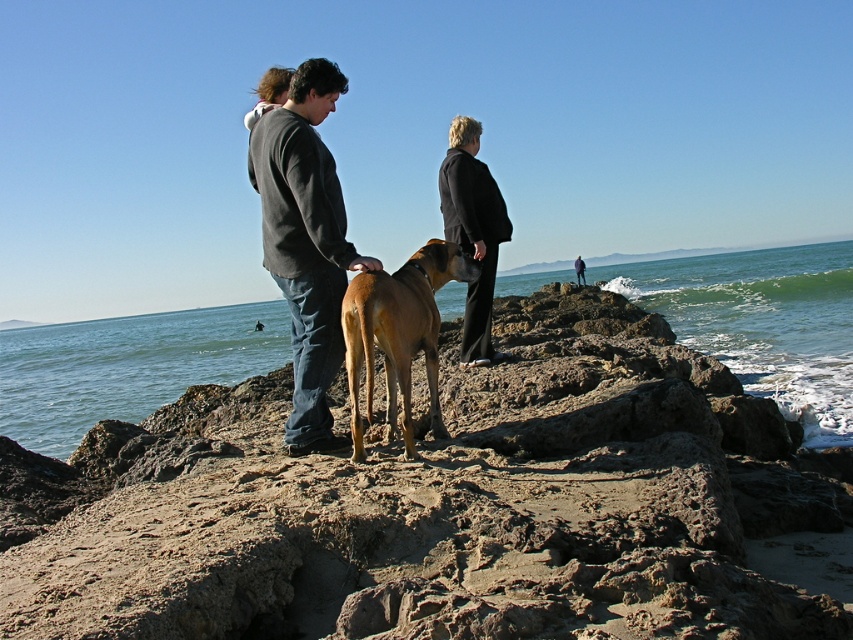
Question: Which of the following is the closest to the observer?

Choices:
 (A) dark blue jacket at center
 (B) brown rock at center
 (C) dark gray hoodie at center
 (D) brown fur dog at center

Answer: (B)

Question: Is clear blue water at center wider than dark gray hoodie at center?

Choices:
 (A) yes
 (B) no

Answer: (A)

Question: Among these points, which one is farthest from the camera?

Choices:
 (A) (477, 253)
 (B) (581, 276)
 (C) (299, 490)

Answer: (B)

Question: Is dark gray hoodie at center smaller than dark blue jacket at center?

Choices:
 (A) yes
 (B) no

Answer: (B)

Question: Is brown rock at center behind dark gray hoodie at center?

Choices:
 (A) yes
 (B) no

Answer: (B)

Question: Which object is closer to the camera taking this photo?

Choices:
 (A) clear blue water at center
 (B) dark gray hoodie at center

Answer: (B)